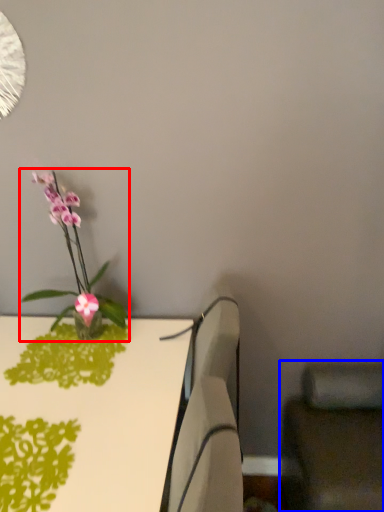
Question: Which of the following is the closest to the observer, houseplant (highlighted by a red box) or swivel chair (highlighted by a blue box)?

Choices:
 (A) houseplant
 (B) swivel chair

Answer: (B)